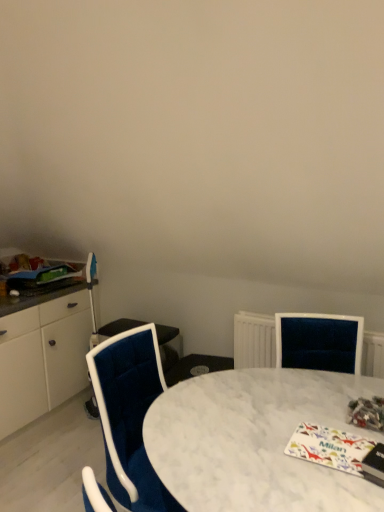
This screenshot has width=384, height=512. What do you see at coordinates (374, 465) in the screenshot? I see `multicolored glossy magazine at lower right, the 2th magazine positioned from the top` at bounding box center [374, 465].

You are a GUI agent. You are given a task and a screenshot of the screen. Output one action in this format:
    pyautogui.click(x=<x>, y=<y>)
    Task: Click on the white glossy magazine at lower right, the 2th magazine when ordered from front to back
    This screenshot has width=384, height=512.
    Given the screenshot: What is the action you would take?
    pyautogui.click(x=329, y=447)

What do you see at coordinates (256, 441) in the screenshot?
I see `white marble table at center` at bounding box center [256, 441].

Find the location of a particular element. Image resolution: width=384 pixels, height=512 pixels. multicolored glossy magazine at lower right, which is counted as the second magazine, starting from the bottom is located at coordinates (374, 465).

Visually, is matte green magazine at left, which ranks as the 1th magazine in top-to-bottom order, positioned to the left or to the right of white glossy magazine at lower right, the 2th magazine when ordered from left to right?

In the image, matte green magazine at left, which ranks as the 1th magazine in top-to-bottom order, appears on the left side of white glossy magazine at lower right, the 2th magazine when ordered from left to right.

Would you say matte green magazine at left, the 1th magazine when ordered from left to right, is inside or outside white glossy magazine at lower right, which is the third magazine from top to bottom?

matte green magazine at left, the 1th magazine when ordered from left to right, is not enclosed by white glossy magazine at lower right, which is the third magazine from top to bottom.

From the image's perspective, is matte green magazine at left, the 1th magazine viewed from the back, over white glossy magazine at lower right, the 1th magazine positioned from the bottom?

Indeed, from the image's perspective, matte green magazine at left, the 1th magazine viewed from the back, is shown above white glossy magazine at lower right, the 1th magazine positioned from the bottom.

From a real-world perspective, is matte green magazine at left, which is counted as the 3th magazine, starting from the right, located higher than white glossy magazine at lower right, the 2th magazine from the right?

Yes, from a real-world perspective, matte green magazine at left, which is counted as the 3th magazine, starting from the right, is on top of white glossy magazine at lower right, the 2th magazine from the right.

Based on the photo, is white marble table at center placed right next to white glossy magazine at lower right, which is the third magazine from top to bottom?

white marble table at center and white glossy magazine at lower right, which is the third magazine from top to bottom, are clearly separated.

Does white marble table at center have a smaller size compared to white glossy magazine at lower right, the 2th magazine when ordered from left to right?

Actually, white marble table at center might be larger than white glossy magazine at lower right, the 2th magazine when ordered from left to right.

Is point (225, 378) behind point (310, 457)?

That is True.

Is white glossy magazine at lower right, the 2th magazine viewed from the back, at the back of white marble table at center?

That's not correct — white marble table at center is not looking away from white glossy magazine at lower right, the 2th magazine viewed from the back.

From the image's perspective, would you say multicolored glossy magazine at lower right, which is counted as the second magazine, starting from the bottom, is positioned over velvet blue chair at center?

Correct, multicolored glossy magazine at lower right, which is counted as the second magazine, starting from the bottom, appears higher than velvet blue chair at center in the image.

Is multicolored glossy magazine at lower right, the 3th magazine from the back, bigger than velvet blue chair at center?

No.

Is multicolored glossy magazine at lower right, the 1th magazine when ordered from right to left, not close to velvet blue chair at center?

No.

Is multicolored glossy magazine at lower right, which is counted as the second magazine, starting from the bottom, aimed at velvet blue chair at center?

No, multicolored glossy magazine at lower right, which is counted as the second magazine, starting from the bottom, is not aimed at velvet blue chair at center.

Between white marble table at center and velvet blue chair at center, which one has smaller width?

With smaller width is velvet blue chair at center.

From a real-world perspective, is white marble table at center physically below velvet blue chair at center?

No, from a real-world perspective, white marble table at center is not under velvet blue chair at center.

The image size is (384, 512). In order to click on desk that is above the velvet blue chair at center (from a real-world perspective) in this screenshot , I will do `click(256, 441)`.

Looking at this image, is white marble table at center closer to the viewer compared to velvet blue chair at center?

Yes, the depth of white marble table at center is less than that of velvet blue chair at center.

From a real-world perspective, is velvet blue chair at center located beneath multicolored glossy magazine at lower right, which is counted as the second magazine, starting from the bottom?

Yes, from a real-world perspective, velvet blue chair at center is below multicolored glossy magazine at lower right, which is counted as the second magazine, starting from the bottom.

Is velvet blue chair at center facing towards multicolored glossy magazine at lower right, which is counted as the second magazine, starting from the bottom?

Yes.

Is velvet blue chair at center located outside multicolored glossy magazine at lower right, which is counted as the second magazine, starting from the bottom?

Yes.

Is velvet blue chair at center taller than multicolored glossy magazine at lower right, placed as the first magazine when sorted from front to back?

Indeed, velvet blue chair at center has a greater height compared to multicolored glossy magazine at lower right, placed as the first magazine when sorted from front to back.

Where is `chair lying on the left of white marble table at center`? chair lying on the left of white marble table at center is located at coordinates (130, 416).

Is velvet blue chair at center wider than white marble table at center?

No.

Considering the positions of objects velvet blue chair at center and white marble table at center in the image provided, who is more to the left, velvet blue chair at center or white marble table at center?

velvet blue chair at center is more to the left.

From a real-world perspective, who is located higher, velvet blue chair at center or white marble table at center?

From a 3D spatial view, white marble table at center is above.

Does matte green magazine at left, which ranks as the 1th magazine in top-to-bottom order, have a smaller size compared to multicolored glossy magazine at lower right, arranged as the 3th magazine when viewed from the left?

No.

Does point (70, 272) lie in front of point (372, 458)?

No, (70, 272) is further to viewer.

Is matte green magazine at left, the 1th magazine viewed from the back, facing towards multicolored glossy magazine at lower right, arranged as the 3th magazine when viewed from the left?

Yes, matte green magazine at left, the 1th magazine viewed from the back, is facing multicolored glossy magazine at lower right, arranged as the 3th magazine when viewed from the left.

Is matte green magazine at left, placed as the third magazine when sorted from bottom to top, to the left of multicolored glossy magazine at lower right, placed as the first magazine when sorted from front to back, from the viewer's perspective?

Indeed, matte green magazine at left, placed as the third magazine when sorted from bottom to top, is positioned on the left side of multicolored glossy magazine at lower right, placed as the first magazine when sorted from front to back.

You are a GUI agent. You are given a task and a screenshot of the screen. Output one action in this format:
    pyautogui.click(x=<x>, y=<y>)
    Task: Click on the 1st magazine to the right of the matte green magazine at left, placed as the third magazine when sorted from bottom to top, counting from the anchor's position
    This screenshot has width=384, height=512.
    Given the screenshot: What is the action you would take?
    pyautogui.click(x=329, y=447)

Where is `the 2nd magazine behind the white marble table at center`? the 2nd magazine behind the white marble table at center is located at coordinates (329, 447).

Which object lies further to the anchor point white marble table at center, multicolored glossy magazine at lower right, the 2th magazine positioned from the top, or matte green magazine at left, the 1th magazine viewed from the back?

matte green magazine at left, the 1th magazine viewed from the back, lies further to white marble table at center than the other object.

In the scene shown: Looking at the image, which one is located closer to white glossy magazine at lower right, the 2th magazine viewed from the back, white marble table at center or velvet blue chair at center?

white marble table at center is positioned closer to the anchor white glossy magazine at lower right, the 2th magazine viewed from the back.

Considering their positions, is white glossy magazine at lower right, which is the third magazine from top to bottom, positioned further to matte green magazine at left, the 3th magazine viewed from the front, than multicolored glossy magazine at lower right, the 1th magazine when ordered from right to left?

multicolored glossy magazine at lower right, the 1th magazine when ordered from right to left, is positioned further to the anchor matte green magazine at left, the 3th magazine viewed from the front.

Estimate the real-world distances between objects in this image. Which object is further from matte green magazine at left, which ranks as the 1th magazine in top-to-bottom order, white glossy magazine at lower right, the 1th magazine positioned from the bottom, or velvet blue chair at center?

Among the two, white glossy magazine at lower right, the 1th magazine positioned from the bottom, is located further to matte green magazine at left, which ranks as the 1th magazine in top-to-bottom order.

Considering their positions, is multicolored glossy magazine at lower right, which is counted as the second magazine, starting from the bottom, positioned closer to velvet blue chair at center than white glossy magazine at lower right, the 2th magazine when ordered from left to right?

white glossy magazine at lower right, the 2th magazine when ordered from left to right, is positioned closer to the anchor velvet blue chair at center.

When comparing their distances from matte green magazine at left, which ranks as the 1th magazine in top-to-bottom order, does multicolored glossy magazine at lower right, which is counted as the second magazine, starting from the bottom, or velvet blue chair at center seem further?

Among the two, multicolored glossy magazine at lower right, which is counted as the second magazine, starting from the bottom, is located further to matte green magazine at left, which ranks as the 1th magazine in top-to-bottom order.

Based on their spatial positions, is white glossy magazine at lower right, the 2th magazine when ordered from front to back, or multicolored glossy magazine at lower right, arranged as the 3th magazine when viewed from the left, further from white marble table at center?

The object further to white marble table at center is multicolored glossy magazine at lower right, arranged as the 3th magazine when viewed from the left.

When comparing their distances from white marble table at center, does multicolored glossy magazine at lower right, the 1th magazine when ordered from right to left, or white glossy magazine at lower right, the 2th magazine when ordered from front to back, seem closer?

white glossy magazine at lower right, the 2th magazine when ordered from front to back.

Identify the location of magazine located between white marble table at center and white glossy magazine at lower right, the 2th magazine from the right, in the depth direction. (374, 465).

Find the location of `magazine situated between matte green magazine at left, which ranks as the 1th magazine in top-to-bottom order, and multicolored glossy magazine at lower right, which is counted as the second magazine, starting from the bottom, from left to right`. magazine situated between matte green magazine at left, which ranks as the 1th magazine in top-to-bottom order, and multicolored glossy magazine at lower right, which is counted as the second magazine, starting from the bottom, from left to right is located at coordinates (329, 447).

What are the coordinates of `desk situated between velvet blue chair at center and multicolored glossy magazine at lower right, placed as the first magazine when sorted from front to back, from left to right` in the screenshot? It's located at (256, 441).

Identify the location of chair between matte green magazine at left, the 1th magazine viewed from the back, and multicolored glossy magazine at lower right, arranged as the 3th magazine when viewed from the left, from left to right. This screenshot has height=512, width=384. (130, 416).